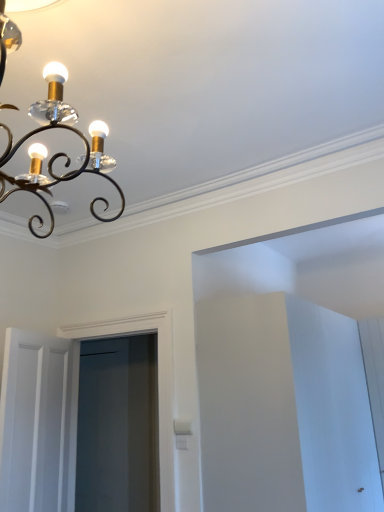
Question: From the image's perspective, is white wooden door at lower left positioned above or below clear glass screen door at center?

Choices:
 (A) above
 (B) below

Answer: (B)

Question: Looking at the image, does white wooden door at lower left seem bigger or smaller compared to clear glass screen door at center?

Choices:
 (A) small
 (B) big

Answer: (A)

Question: Which is nearer to the clear glass screen door at center?

Choices:
 (A) matte black chandelier at upper left
 (B) white wooden door at lower left

Answer: (B)

Question: Estimate the real-world distances between objects in this image. Which object is closer to the white wooden door at lower left?

Choices:
 (A) matte black chandelier at upper left
 (B) clear glass screen door at center

Answer: (B)